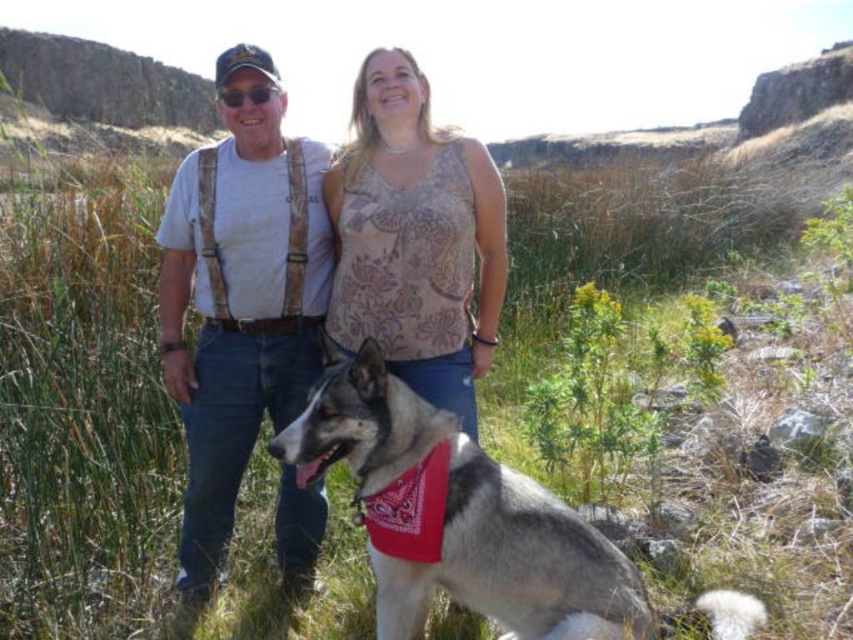
Question: Which of these objects is positioned closest to the matte black goggles at upper center?

Choices:
 (A) light gray t-shirt at center
 (B) gray fur dog at center

Answer: (A)

Question: Does gray fur dog at center lie behind matte black goggles at upper center?

Choices:
 (A) no
 (B) yes

Answer: (A)

Question: Does light gray t-shirt at center appear on the right side of gray fur dog at center?

Choices:
 (A) no
 (B) yes

Answer: (A)

Question: Is light gray t-shirt at center thinner than gray fur dog at center?

Choices:
 (A) no
 (B) yes

Answer: (B)

Question: Which point appears closest to the camera in this image?

Choices:
 (A) (494, 557)
 (B) (396, 198)
 (C) (167, 225)

Answer: (A)

Question: Among these points, which one is farthest from the camera?

Choices:
 (A) (360, 65)
 (B) (180, 188)
 (C) (262, 100)
 (D) (489, 595)

Answer: (A)